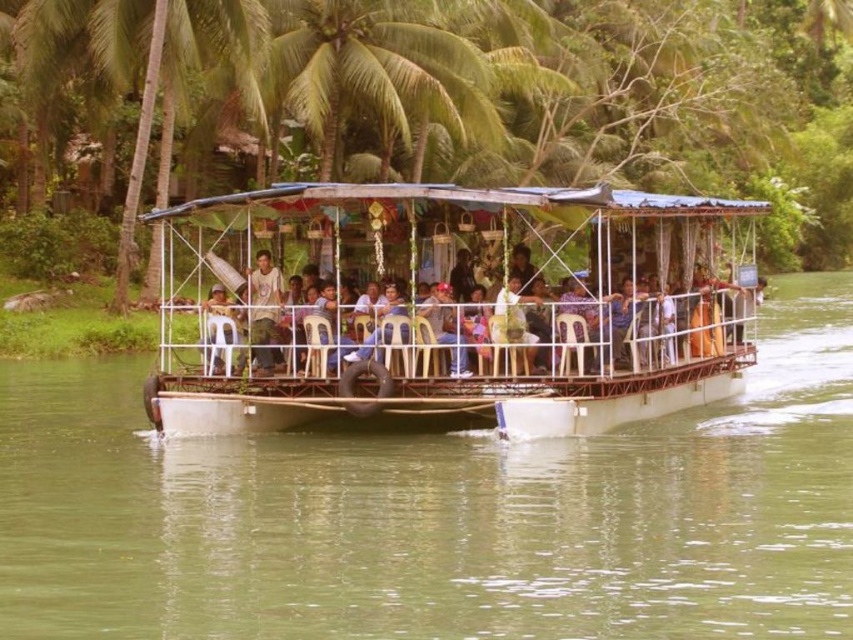
Question: Is the position of white plastic boat at center more distant than that of white plastic chair at center?

Choices:
 (A) yes
 (B) no

Answer: (B)

Question: Estimate the real-world distances between objects in this image. Which object is farther from the green plastic boat at center?

Choices:
 (A) white plastic chair at center
 (B) white plastic boat at center

Answer: (B)

Question: Is green plastic boat at center below white plastic boat at center?

Choices:
 (A) no
 (B) yes

Answer: (B)

Question: Which object appears closest to the camera in this image?

Choices:
 (A) green plastic boat at center
 (B) white plastic chair at center

Answer: (A)

Question: Is white plastic boat at center further to camera compared to white plastic chair at center?

Choices:
 (A) no
 (B) yes

Answer: (A)

Question: Which of the following is the closest to the observer?

Choices:
 (A) pyautogui.click(x=712, y=305)
 (B) pyautogui.click(x=416, y=397)
 (C) pyautogui.click(x=749, y=476)

Answer: (C)